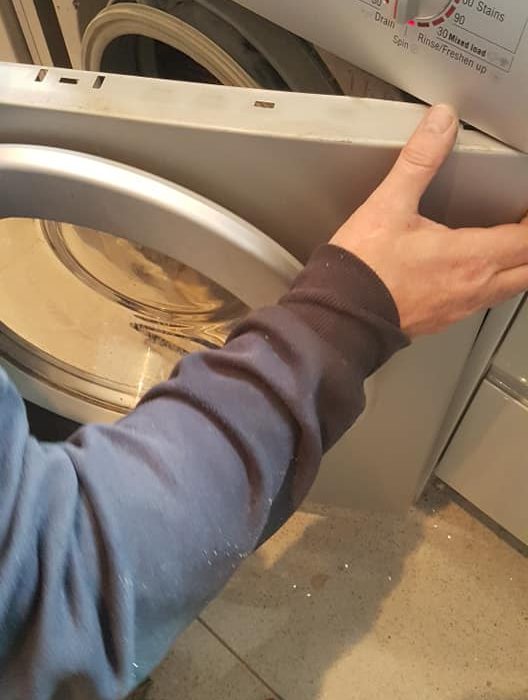
The image size is (528, 700). What are the coordinates of `drain` in the screenshot? It's located at (374, 21).